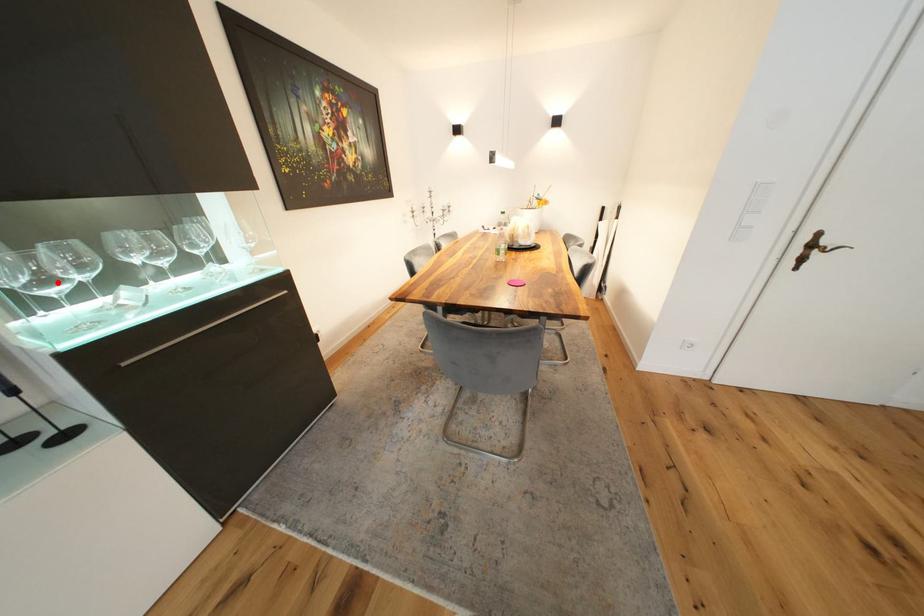
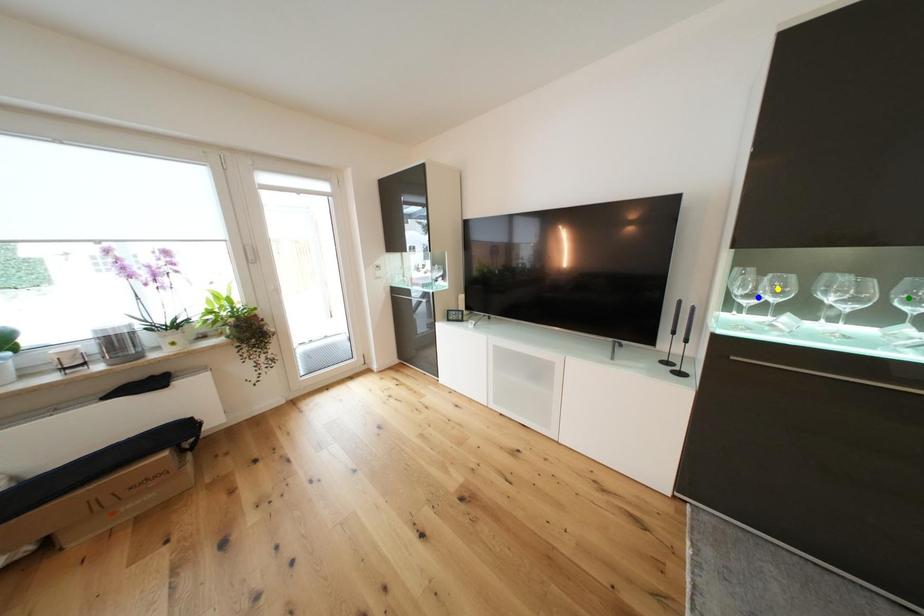
Question: I am providing you with two images of the same scene from different viewpoints. A red point is marked on the first image. You are given multiple points on the second image. Can you choose the point in image 2 that corresponds to the point in image 1?

Choices:
 (A) green point
 (B) blue point
 (C) yellow point

Answer: (B)